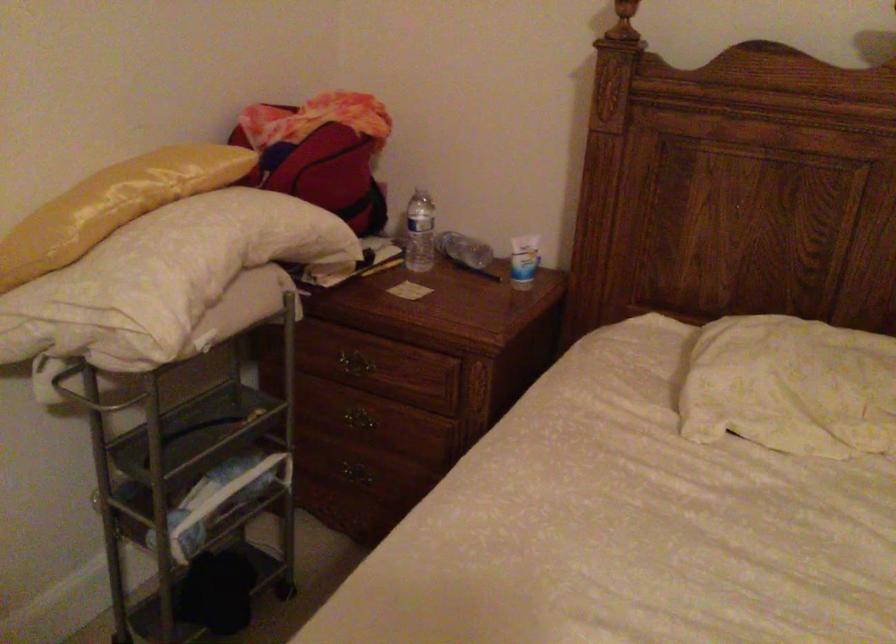
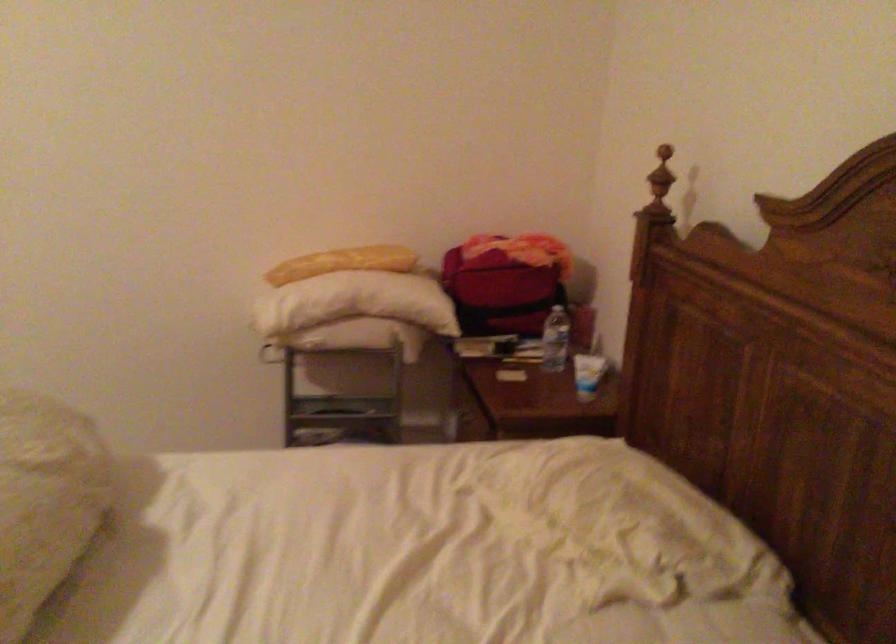
Locate, in the second image, the point that corresponds to point (437, 230) in the first image.

(556, 339)